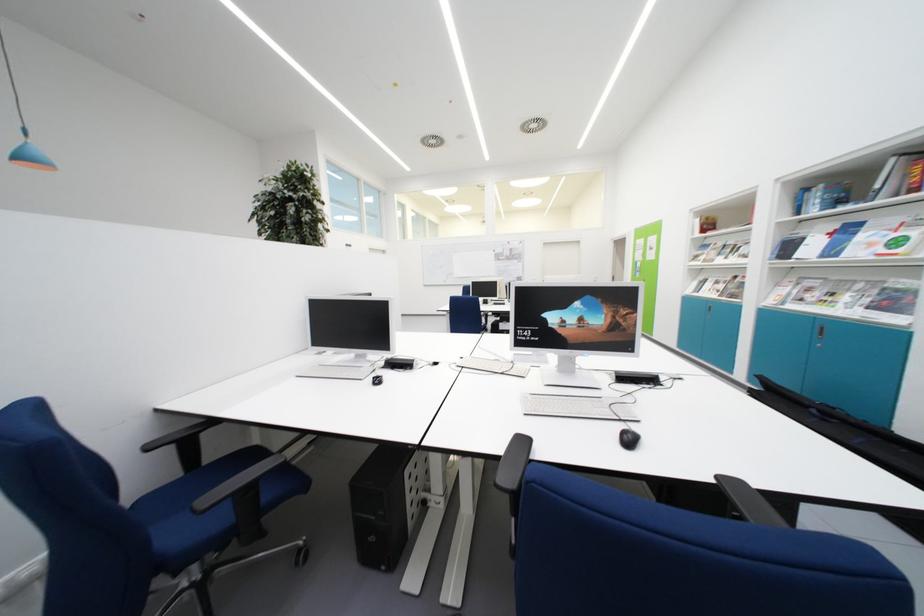
The width and height of the screenshot is (924, 616). What do you see at coordinates (171, 438) in the screenshot?
I see `a blue chair sitting surface` at bounding box center [171, 438].